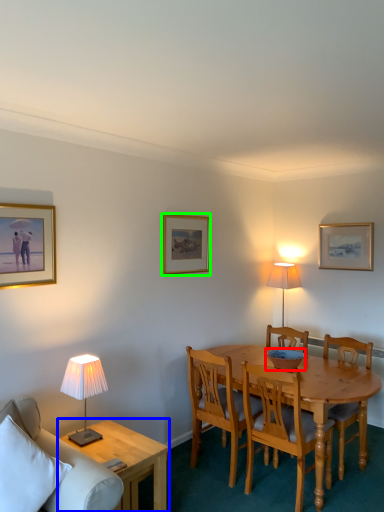
Question: Which object is the farthest from bowl (highlighted by a red box)? Choose among these: coffee table (highlighted by a blue box) or picture frame (highlighted by a green box).

Choices:
 (A) coffee table
 (B) picture frame

Answer: (A)